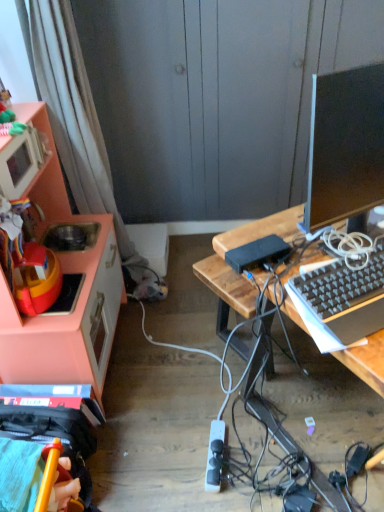
This screenshot has width=384, height=512. In order to click on spots to the right of black matte power bank at center in this screenshot , I will do `click(298, 251)`.